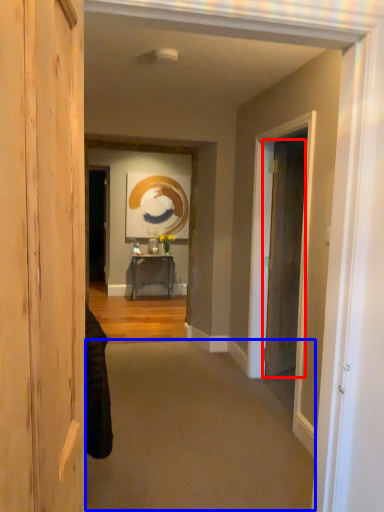
Question: Which point is further to the camera, door (highlighted by a red box) or plain (highlighted by a blue box)?

Choices:
 (A) door
 (B) plain

Answer: (A)